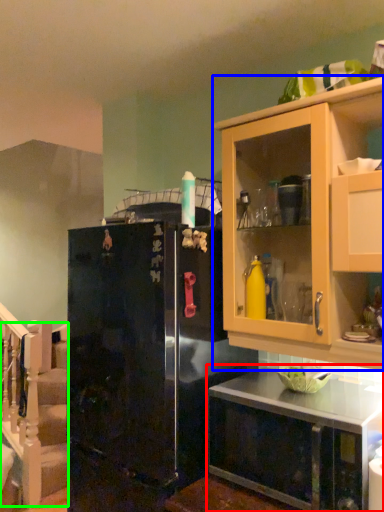
Question: Which is farther away from countertop (highlighted by a red box)? cabinetry (highlighted by a blue box) or stairwell (highlighted by a green box)?

Choices:
 (A) cabinetry
 (B) stairwell

Answer: (B)